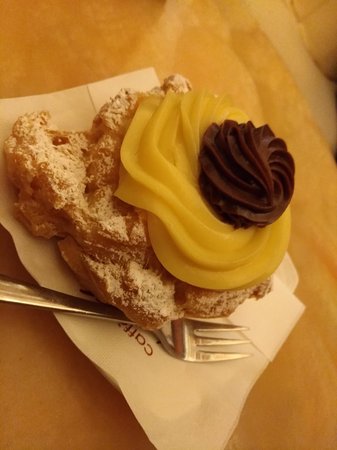
Identify the location of sides of napkin. This screenshot has width=337, height=450. (76, 342), (252, 383).